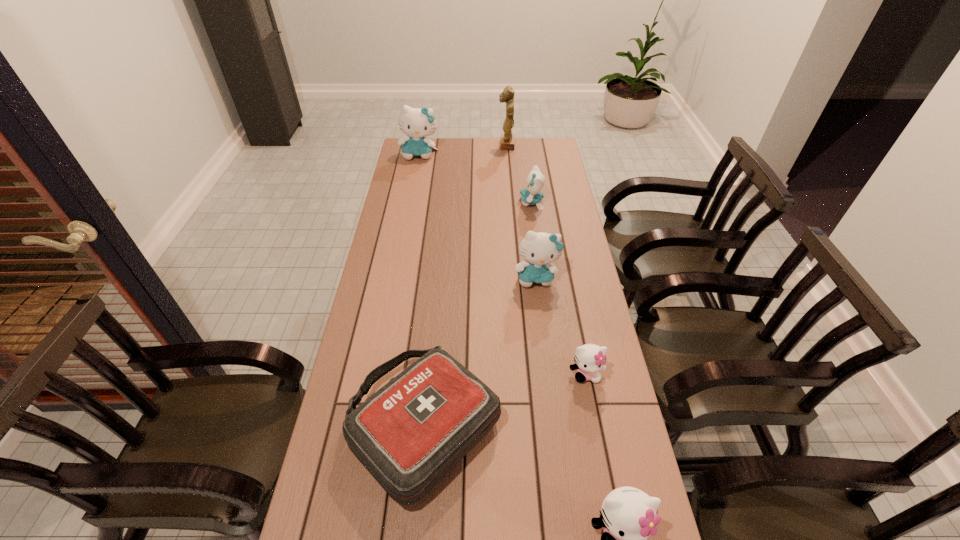
In order to click on free spot located 0.360m on the front-facing side of the tallest object in this screenshot , I will do `click(423, 145)`.

At what (x,y) coordinates should I click in order to perform the action: click on vacant region located on the front-facing side of the tallest object. Please return your answer as a coordinate pair (x, y). This screenshot has height=540, width=960. Looking at the image, I should click on (420, 145).

Find the location of `free location located on the front-facing side of the tallest object`. free location located on the front-facing side of the tallest object is located at coordinates (420, 145).

Find the location of a particular element. vacant space located 0.290m on the face of the farthest blue kitten is located at coordinates (411, 199).

Find the location of `free space located 0.300m on the face of the second smallest blue kitten`. free space located 0.300m on the face of the second smallest blue kitten is located at coordinates (547, 368).

Identify the location of free region located 0.310m on the face of the smallest blue kitten. (444, 202).

The height and width of the screenshot is (540, 960). I want to click on vacant position located on the face of the smallest blue kitten, so click(464, 202).

This screenshot has width=960, height=540. In order to click on free space located 0.310m on the face of the smallest blue kitten in this screenshot , I will do `click(444, 202)`.

Locate an element on the screen. This screenshot has width=960, height=540. vacant area located 0.310m on the back of the red first-aid kit is located at coordinates (439, 281).

Where is `vacant space situated on the front-facing side of the farther white kitten`? The width and height of the screenshot is (960, 540). vacant space situated on the front-facing side of the farther white kitten is located at coordinates (597, 431).